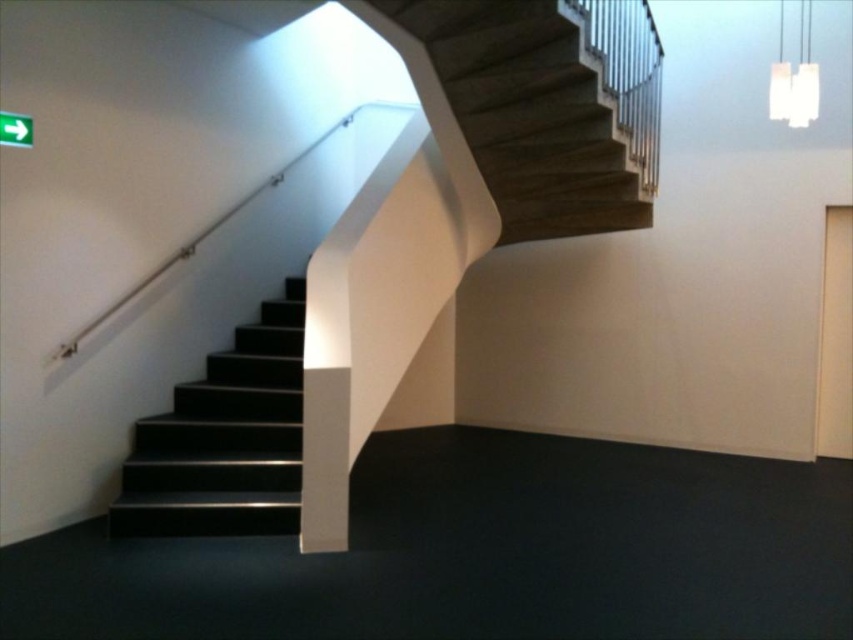
You are moving a large painting that is 1.2 meters wide. You need to carry it down the stairs while keeping it horizontal. The painting is too wide to tilt. Can you safely navigate the dark wood stairs at upper center and the black glossy stairs at left without the painting hitting the walls or handrails?

The dark wood stairs at upper center is positioned on the right side of black glossy stairs at left. Since the painting is 1.2 meters wide and the distance between the handrail on the left and the wall on the right is not specified, it is uncertain if there is enough space. However, since the dark wood stairs are on the right of the black glossy stairs, the total width might be sufficient. Without exact measurements, it is risky to attempt moving the painting without further information.

You are moving a large painting down the stairs and need to know which set of stairs is closer to you. Which one is closer between the dark wood stairs at upper center and the black glossy stairs at left?

The dark wood stairs at upper center is closer to you since it is positioned in front of the black glossy stairs at left.

You are standing at the entrance of the staircase and want to reach the dark wood stairs at upper center. According to the coordinates given, where should you head to locate them?

The dark wood stairs at upper center are located at coordinates point (549,106), so you should head towards that position to reach them.